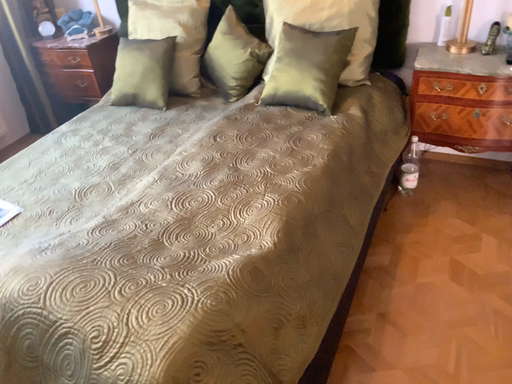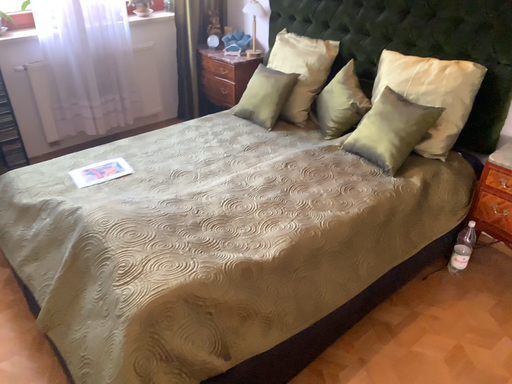
Question: How did the camera likely rotate when shooting the video?

Choices:
 (A) rotated right
 (B) rotated left

Answer: (B)